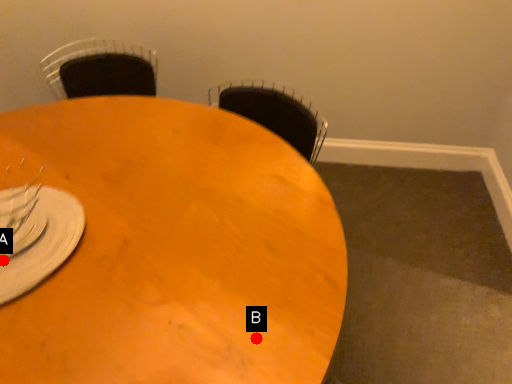
Question: Two points are circled on the image, labeled by A and B beside each circle. Among these points, which one is farthest from the camera?

Choices:
 (A) A is further
 (B) B is further

Answer: (A)